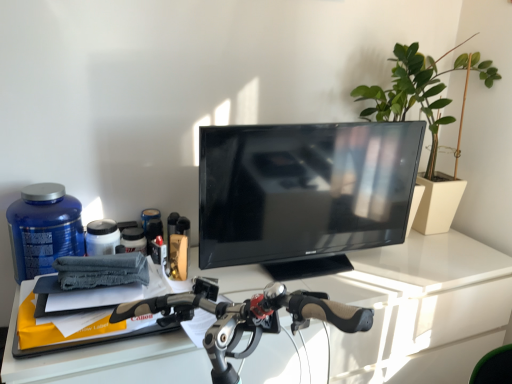
Find the location of a particular element. blue matte bottle at left is located at coordinates (42, 229).

What do you see at coordinates (419, 307) in the screenshot? I see `white glossy desk at center` at bounding box center [419, 307].

At what (x,y) coordinates should I click in order to perform the action: click on blue matte bottle at left. Please return your answer as a coordinate pair (x, y). This screenshot has width=512, height=384. Looking at the image, I should click on (42, 229).

How different are the orientations of green matte plant at upper right and white glossy desk at center in degrees?

They differ by 0.669 degrees in their facing directions.

Does green matte plant at upper right appear on the right side of white glossy desk at center?

Yes.

Does point (495, 76) come farther from viewer compared to point (389, 322)?

Yes.

Is green matte plant at upper right not inside white glossy desk at center?

Yes.

Is green matte plant at upper right not inside blue matte bottle at left?

Yes, green matte plant at upper right is located beyond the bounds of blue matte bottle at left.

Is green matte plant at upper right thinner than blue matte bottle at left?

Incorrect, the width of green matte plant at upper right is not less than that of blue matte bottle at left.

Can you confirm if green matte plant at upper right is positioned to the right of blue matte bottle at left?

Correct, you'll find green matte plant at upper right to the right of blue matte bottle at left.

Who is shorter, white glossy desk at center or green matte plant at upper right?

green matte plant at upper right is shorter.

Is the depth of white glossy desk at center less than that of green matte plant at upper right?

Yes, white glossy desk at center is closer to the camera.

Can green matte plant at upper right be found inside white glossy desk at center?

No, white glossy desk at center does not contain green matte plant at upper right.

How different are the orientations of white glossy desk at center and green matte plant at upper right in degrees?

The facing directions of white glossy desk at center and green matte plant at upper right are 0.669 degrees apart.

Image resolution: width=512 pixels, height=384 pixels. Identify the location of houseplant above the blue matte bottle at left (from the image's perspective). (419, 89).

Is blue matte bottle at left further to the viewer compared to green matte plant at upper right?

No.

Who is shorter, blue matte bottle at left or green matte plant at upper right?

blue matte bottle at left.

Measure the distance from blue matte bottle at left to green matte plant at upper right.

blue matte bottle at left is 1.19 meters away from green matte plant at upper right.

Based on their sizes in the image, would you say blue matte bottle at left is bigger or smaller than white glossy desk at center?

blue matte bottle at left is smaller than white glossy desk at center.

Locate an element on the screen. bottle that appears above the white glossy desk at center (from the image's perspective) is located at coordinates (42, 229).

Which object is closer to the camera, blue matte bottle at left or white glossy desk at center?

white glossy desk at center is closer to the camera.

From the image's perspective, which one is positioned lower, blue matte bottle at left or white glossy desk at center?

white glossy desk at center is shown below in the image.

Which object is positioned more to the left, white glossy desk at center or blue matte bottle at left?

Positioned to the left is blue matte bottle at left.

Can you confirm if white glossy desk at center is smaller than blue matte bottle at left?

Incorrect, white glossy desk at center is not smaller in size than blue matte bottle at left.

Is white glossy desk at center positioned far away from blue matte bottle at left?

They are positioned close to each other.

Is white glossy desk at center outside of blue matte bottle at left?

white glossy desk at center is positioned outside blue matte bottle at left.

In terms of width, does black glossy tv at center look wider or thinner when compared to green matte plant at upper right?

black glossy tv at center is thinner than green matte plant at upper right.

Is black glossy tv at center taller than green matte plant at upper right?

No, black glossy tv at center is not taller than green matte plant at upper right.

Considering the positions of point (335, 160) and point (378, 92), is point (335, 160) closer or farther from the camera than point (378, 92)?

Clearly, point (335, 160) is closer to the camera than point (378, 92).

What's the angular difference between black glossy tv at center and green matte plant at upper right's facing directions?

5.52 degrees separate the facing orientations of black glossy tv at center and green matte plant at upper right.

This screenshot has height=384, width=512. Identify the location of houseplant above the white glossy desk at center (from a real-world perspective). (419, 89).

I want to click on bottle that appears on the left of green matte plant at upper right, so click(42, 229).

Looking at this image, based on their spatial positions, is white glossy desk at center or black glossy tv at center further from blue matte bottle at left?

black glossy tv at center is positioned further to the anchor blue matte bottle at left.

When comparing their distances from blue matte bottle at left, does green matte plant at upper right or black glossy tv at center seem further?

The object further to blue matte bottle at left is green matte plant at upper right.

When comparing their distances from green matte plant at upper right, does black glossy tv at center or white glossy desk at center seem further?

Among the two, white glossy desk at center is located further to green matte plant at upper right.

Based on their spatial positions, is green matte plant at upper right or white glossy desk at center further from black glossy tv at center?

The object further to black glossy tv at center is green matte plant at upper right.

Which object lies further to the anchor point white glossy desk at center, black glossy tv at center or green matte plant at upper right?

green matte plant at upper right lies further to white glossy desk at center than the other object.

Estimate the real-world distances between objects in this image. Which object is closer to white glossy desk at center, black glossy tv at center or blue matte bottle at left?

Among the two, black glossy tv at center is located nearer to white glossy desk at center.

Which object lies further to the anchor point white glossy desk at center, green matte plant at upper right or black glossy tv at center?

green matte plant at upper right is further to white glossy desk at center.

Estimate the real-world distances between objects in this image. Which object is further from blue matte bottle at left, white glossy desk at center or green matte plant at upper right?

green matte plant at upper right is further to blue matte bottle at left.

In order to click on television between blue matte bottle at left and green matte plant at upper right in this screenshot , I will do `click(304, 193)`.

At what (x,y) coordinates should I click in order to perform the action: click on desk between blue matte bottle at left and black glossy tv at center in the horizontal direction. Please return your answer as a coordinate pair (x, y). This screenshot has width=512, height=384. Looking at the image, I should click on (419, 307).

Image resolution: width=512 pixels, height=384 pixels. I want to click on desk located between blue matte bottle at left and green matte plant at upper right in the left-right direction, so click(x=419, y=307).

I want to click on television between green matte plant at upper right and white glossy desk at center in the up-down direction, so click(304, 193).